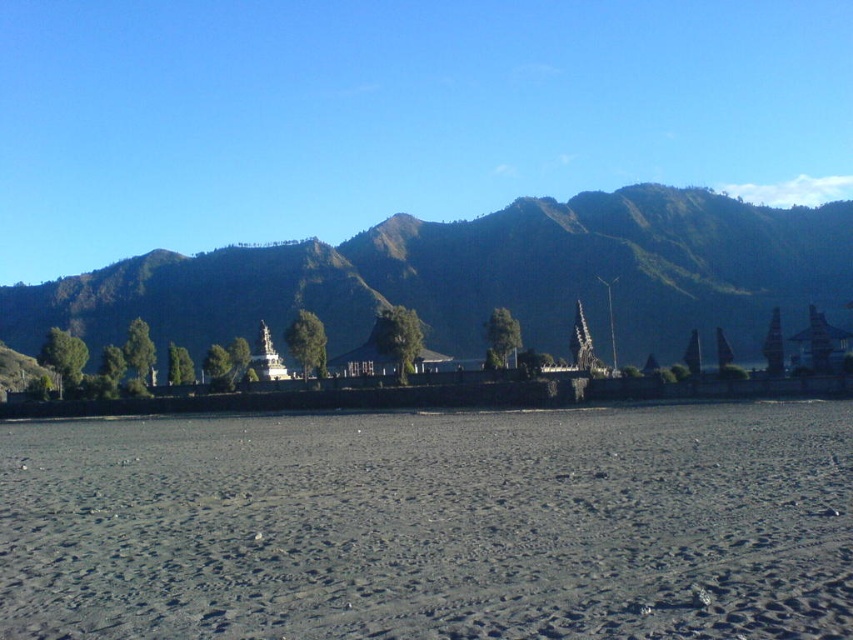
Question: Which of the following is the farthest from the observer?

Choices:
 (A) (117, 582)
 (B) (764, 282)

Answer: (B)

Question: Among these points, which one is farthest from the camera?

Choices:
 (A) (630, 420)
 (B) (753, 216)

Answer: (B)

Question: Which object appears closest to the camera in this image?

Choices:
 (A) dark gray sand at center
 (B) green grassy mountain at left

Answer: (A)

Question: Is dark gray sand at center further to the viewer compared to green grassy mountain at left?

Choices:
 (A) no
 (B) yes

Answer: (A)

Question: Is dark gray sand at center bigger than green grassy mountain at left?

Choices:
 (A) yes
 (B) no

Answer: (B)

Question: Is dark gray sand at center to the right of green grassy mountain at left from the viewer's perspective?

Choices:
 (A) no
 (B) yes

Answer: (B)